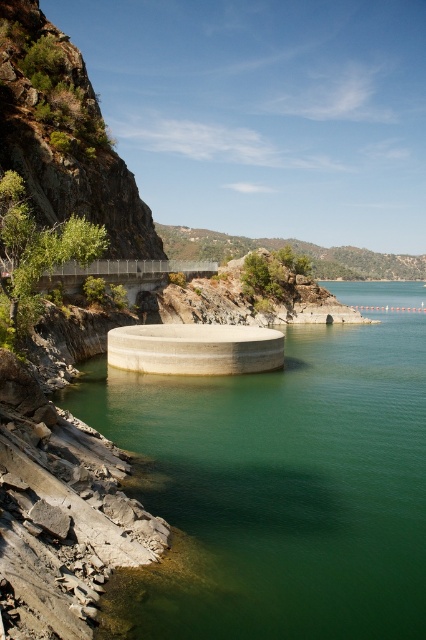
Which is in front, point (313, 387) or point (218, 360)?

Point (218, 360) is in front.

Can you confirm if concrete cylinder at center is wider than gray concrete cylinder at center?

Yes.

Is point (296, 596) positioned before point (154, 355)?

Yes, point (296, 596) is in front of point (154, 355).

The height and width of the screenshot is (640, 426). In order to click on concrete cylinder at center in this screenshot , I will do coord(282,483).